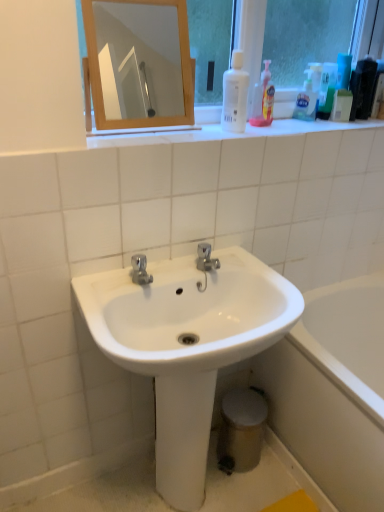
Find the location of `vacant region under white glossy sink at center (from a real-world perspective)`. vacant region under white glossy sink at center (from a real-world perspective) is located at coordinates (177, 506).